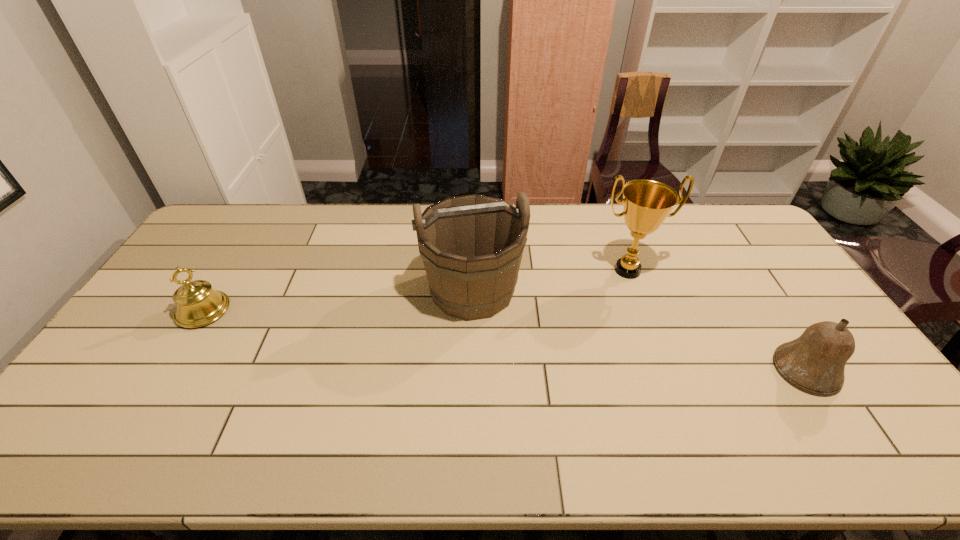
Locate an element on the screen. free space that satisfies the following two spatial constraints: 1. on the front side of the nearer bell; 2. on the right side of the farther bell is located at coordinates (166, 370).